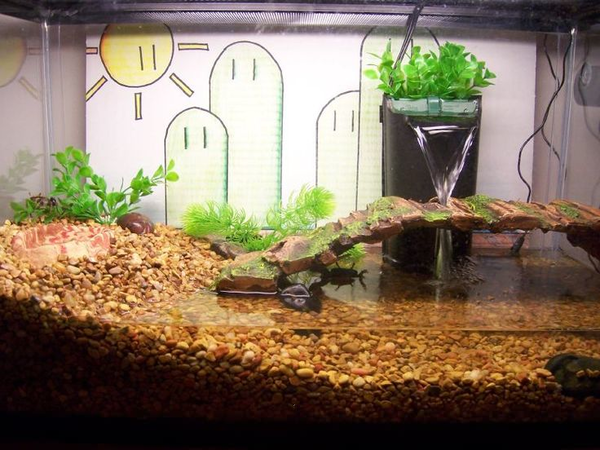
This screenshot has width=600, height=450. I want to click on black cable inside the aquarium, so click(x=405, y=42).